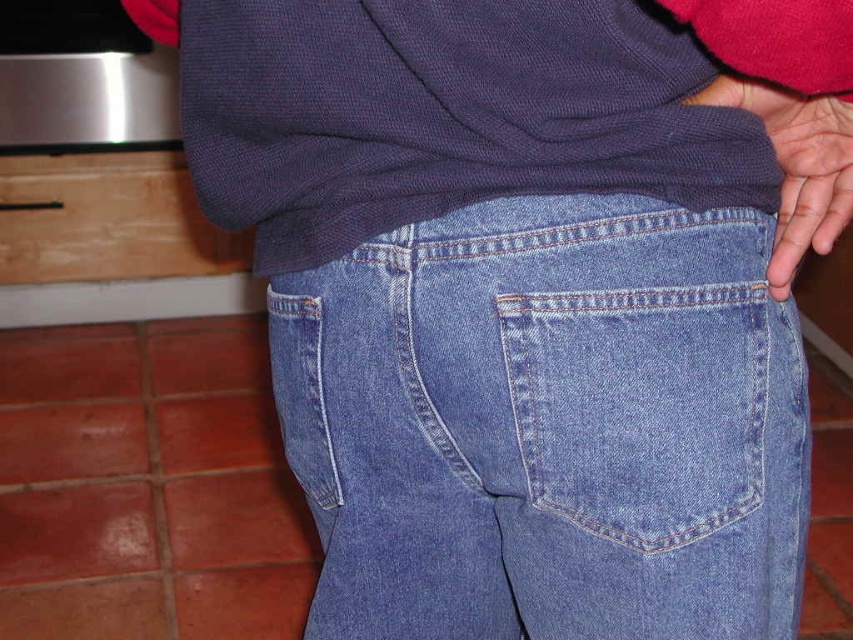
Question: Which of the following is the closest to the observer?

Choices:
 (A) (329, 580)
 (B) (816, 148)
 (C) (577, 397)

Answer: (C)

Question: Does denim blue jeans at center appear under matte blue jeans at lower right?

Choices:
 (A) yes
 (B) no

Answer: (A)

Question: Which object appears closest to the camera in this image?

Choices:
 (A) denim blue jeans pocket at center
 (B) denim blue jeans at center

Answer: (B)

Question: Is denim blue jeans at center above matte blue jeans at lower right?

Choices:
 (A) yes
 (B) no

Answer: (B)

Question: Is denim blue jeans pocket at center below matte blue jeans at lower right?

Choices:
 (A) yes
 (B) no

Answer: (A)

Question: Which point is farther from the camera taking this photo?

Choices:
 (A) (503, 316)
 (B) (780, 132)
 (C) (584, 579)

Answer: (C)